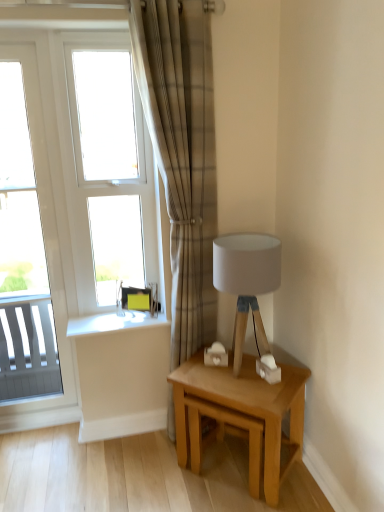
Question: Is light oak wooden table at lower right next to white fabric lampshade at upper right and touching it?

Choices:
 (A) no
 (B) yes

Answer: (A)

Question: Considering the relative sizes of light oak wooden table at lower right and white fabric lampshade at upper right in the image provided, is light oak wooden table at lower right bigger than white fabric lampshade at upper right?

Choices:
 (A) yes
 (B) no

Answer: (A)

Question: From the image's perspective, does light oak wooden table at lower right appear higher than white fabric lampshade at upper right?

Choices:
 (A) no
 (B) yes

Answer: (A)

Question: From a real-world perspective, is light oak wooden table at lower right positioned over white fabric lampshade at upper right based on gravity?

Choices:
 (A) no
 (B) yes

Answer: (A)

Question: Can you confirm if light oak wooden table at lower right is thinner than white fabric lampshade at upper right?

Choices:
 (A) yes
 (B) no

Answer: (B)

Question: Is light oak wooden table at lower right taller than white fabric lampshade at upper right?

Choices:
 (A) yes
 (B) no

Answer: (B)

Question: Is light oak wooden table at lower right at the right side of plaid fabric curtain at center?

Choices:
 (A) no
 (B) yes

Answer: (B)

Question: Is light oak wooden table at lower right behind plaid fabric curtain at center?

Choices:
 (A) no
 (B) yes

Answer: (B)

Question: Considering the relative sizes of light oak wooden table at lower right and plaid fabric curtain at center in the image provided, is light oak wooden table at lower right bigger than plaid fabric curtain at center?

Choices:
 (A) yes
 (B) no

Answer: (B)

Question: Does light oak wooden table at lower right have a lesser height compared to plaid fabric curtain at center?

Choices:
 (A) no
 (B) yes

Answer: (B)

Question: Would you consider light oak wooden table at lower right to be distant from plaid fabric curtain at center?

Choices:
 (A) no
 (B) yes

Answer: (A)

Question: From the image's perspective, is light oak wooden table at lower right above plaid fabric curtain at center?

Choices:
 (A) yes
 (B) no

Answer: (B)

Question: Is plaid fabric curtain at center positioned behind white glossy window at left, acting as the 1th window starting from the left?

Choices:
 (A) yes
 (B) no

Answer: (B)